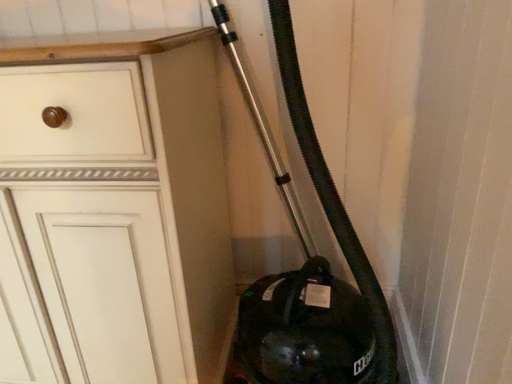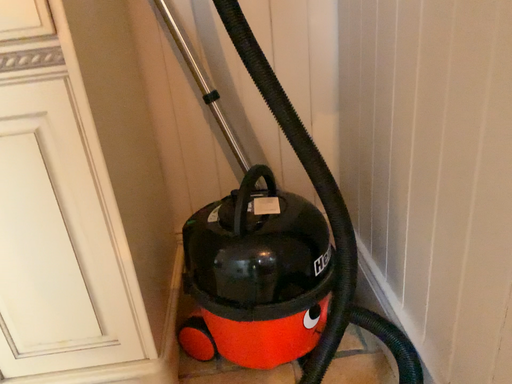
Question: How did the camera likely rotate when shooting the video?

Choices:
 (A) rotated left
 (B) rotated right

Answer: (B)